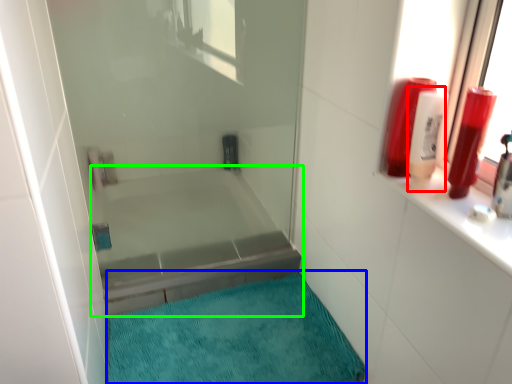
Question: Which object is the closest to the toiletry (highlighted by a red box)? Choose among these: bath mat (highlighted by a blue box) or bathtub (highlighted by a green box).

Choices:
 (A) bath mat
 (B) bathtub

Answer: (A)